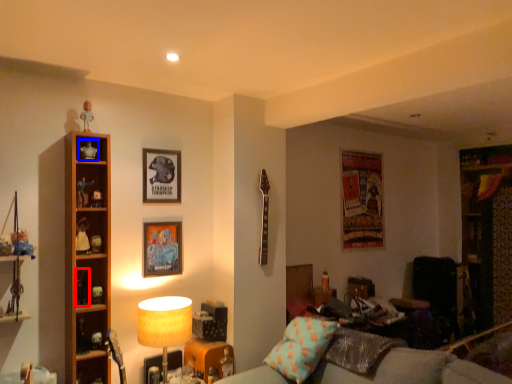
Question: Which of the following is the closest to the observer, toy (highlighted by a red box) or toy (highlighted by a blue box)?

Choices:
 (A) toy
 (B) toy

Answer: (A)